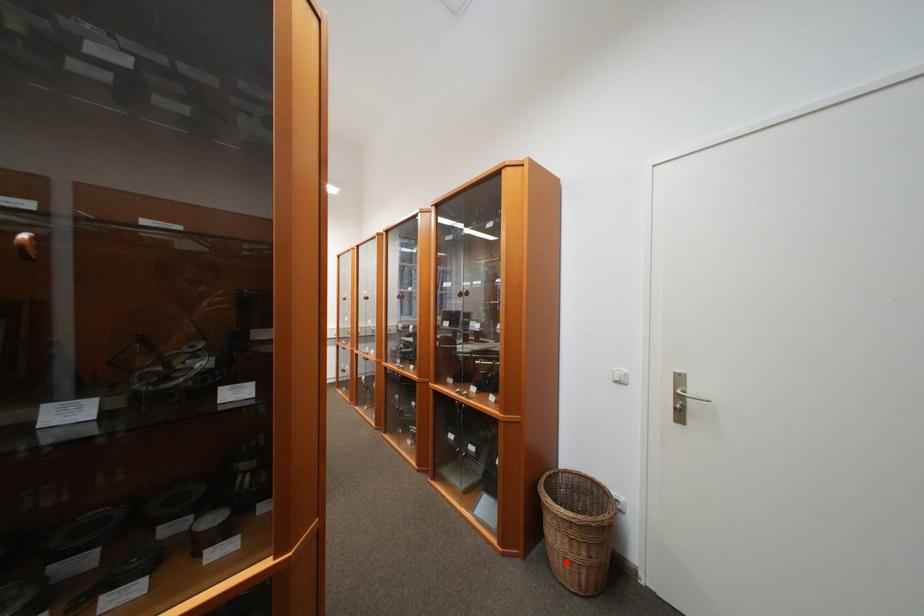
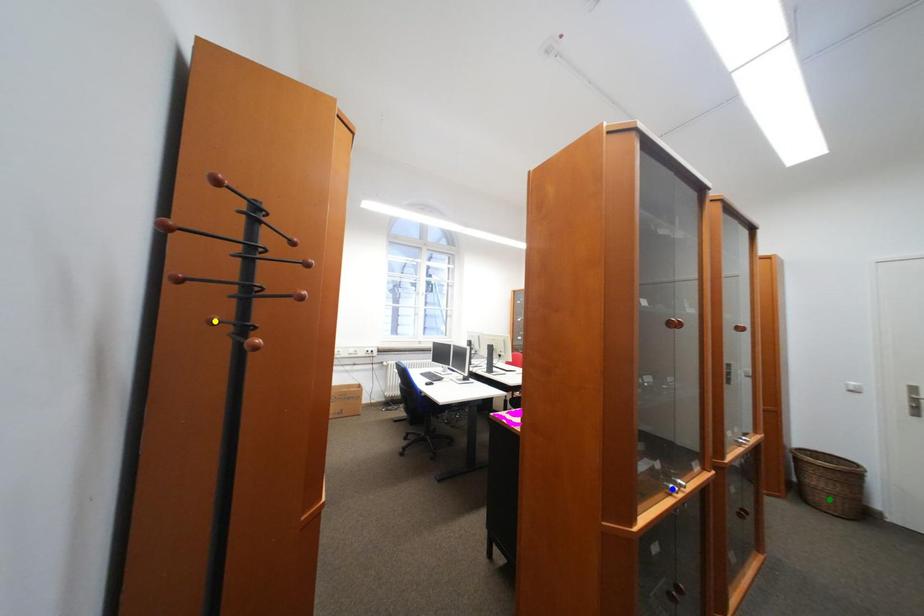
Question: I am providing you with two images of the same scene from different viewpoints. A red point is marked on the first image. You are given multiple points on the second image. Can you choose the point in image 2 that corresponds to the point in image 1?

Choices:
 (A) green point
 (B) blue point
 (C) yellow point

Answer: (A)